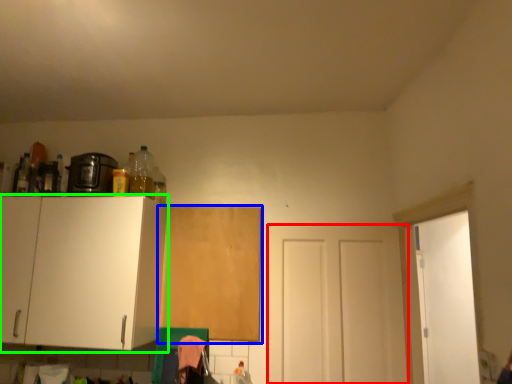
Question: Considering the real-world distances, which object is farthest from door (highlighted by a red box)? cabinetry (highlighted by a blue box) or cabinetry (highlighted by a green box)?

Choices:
 (A) cabinetry
 (B) cabinetry

Answer: (B)